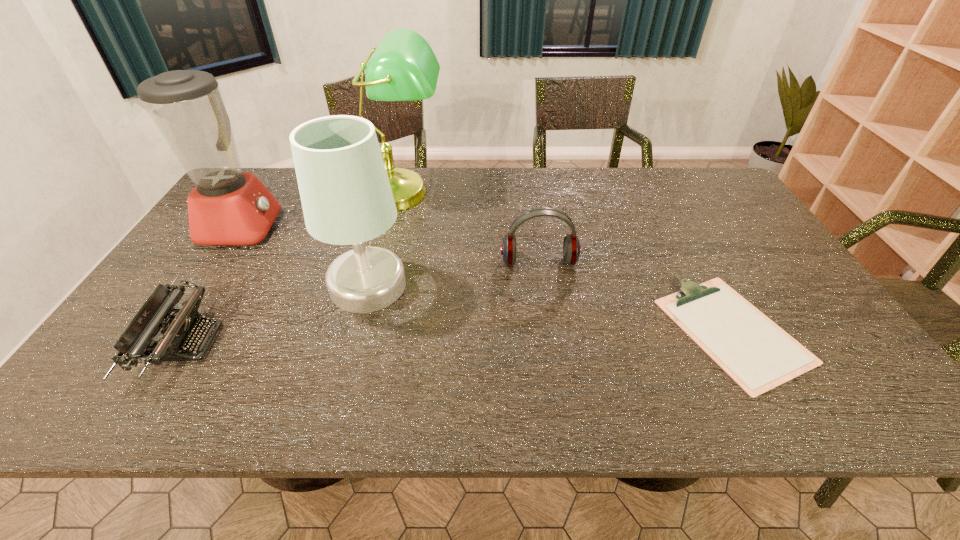
Image resolution: width=960 pixels, height=540 pixels. What are the coordinates of `vacant area that lies between the fifth object from left to right and the blender` in the screenshot? It's located at (391, 245).

Image resolution: width=960 pixels, height=540 pixels. I want to click on empty location between the blender and the earphone, so click(x=391, y=245).

Locate an element on the screen. free area in between the lamp and the lampshade is located at coordinates (384, 239).

At what (x,y) coordinates should I click in order to perform the action: click on free point between the fifth tallest object and the lamp. Please return your answer as a coordinate pair (x, y). This screenshot has height=540, width=960. Looking at the image, I should click on (293, 268).

You are a GUI agent. You are given a task and a screenshot of the screen. Output one action in this format:
    pyautogui.click(x=<x>, y=<y>)
    Task: Click on the vacant point located between the typewriter and the lampshade
    The width and height of the screenshot is (960, 540).
    Given the screenshot: What is the action you would take?
    (x=276, y=314)

Find the location of a particular element. free space between the blender and the lampshade is located at coordinates (305, 256).

Locate an element on the screen. The height and width of the screenshot is (540, 960). object that is the second closest to the blender is located at coordinates point(403,67).

Locate an element on the screen. Image resolution: width=960 pixels, height=540 pixels. object that can be found as the fifth closest to the clipboard is located at coordinates (227, 207).

The image size is (960, 540). What are the coordinates of `free region that satisfies the following two spatial constraints: 1. on the desk next to the lamp; 2. on the front of the blender near the controls` in the screenshot? It's located at (393, 227).

Locate an element on the screen. Image resolution: width=960 pixels, height=540 pixels. vacant position in the image that satisfies the following two spatial constraints: 1. on the ear cups of the second object from right to left; 2. on the base of the lampshade is located at coordinates (542, 285).